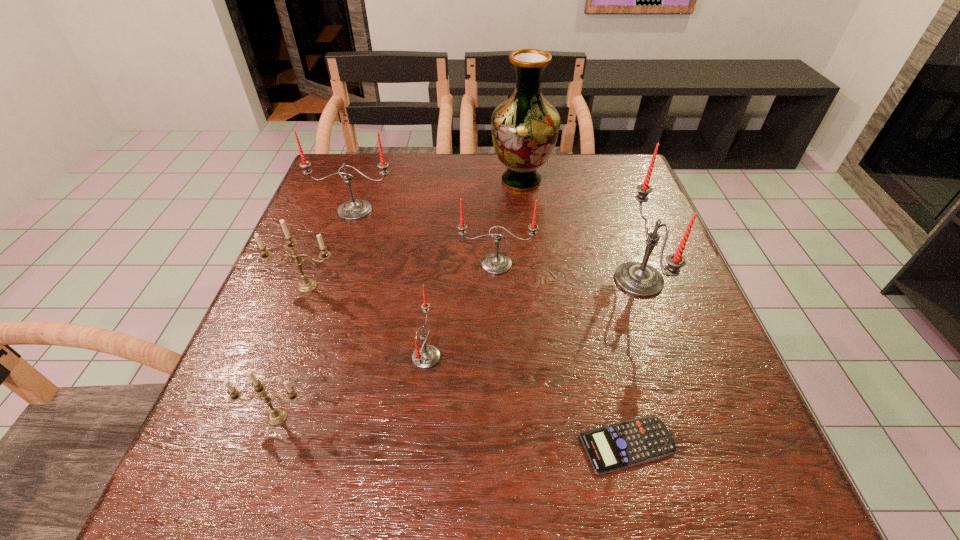
Where is `vacant area that lies between the nearer metallic candle and the second candle from right to left`? The height and width of the screenshot is (540, 960). vacant area that lies between the nearer metallic candle and the second candle from right to left is located at coordinates (387, 341).

Locate an element on the screen. The height and width of the screenshot is (540, 960). empty location between the second candle from right to left and the rightmost red candle is located at coordinates (567, 272).

Locate an element on the screen. unoccupied area between the blue calculator and the nearest candle is located at coordinates (452, 431).

The height and width of the screenshot is (540, 960). I want to click on free space between the farther metallic candle and the third biggest red candle, so click(402, 275).

Locate an element on the screen. The height and width of the screenshot is (540, 960). vacant area between the nearest candle and the third biggest red candle is located at coordinates click(387, 341).

The height and width of the screenshot is (540, 960). In order to click on empty space that is in between the second red candle from left to right and the second smallest red candle in this screenshot , I will do `click(462, 310)`.

Identify which object is located as the second nearest to the rightmost candle. Please provide its 2D coordinates. Your answer should be formatted as a tuple, i.e. [(x, y)], where the tuple contains the x and y coordinates of a point satisfying the conditions above.

[(617, 446)]

Where is `object that is the fourth nearest to the farther metallic candle`? The width and height of the screenshot is (960, 540). object that is the fourth nearest to the farther metallic candle is located at coordinates (277, 416).

Identify which candle is the second nearest to the third tallest object. Please provide its 2D coordinates. Your answer should be formatted as a tuple, i.e. [(x, y)], where the tuple contains the x and y coordinates of a point satisfying the conditions above.

[(496, 263)]

Identify which candle is the fourth nearest to the second smallest red candle. Please provide its 2D coordinates. Your answer should be formatted as a tuple, i.e. [(x, y)], where the tuple contains the x and y coordinates of a point satisfying the conditions above.

[(306, 285)]